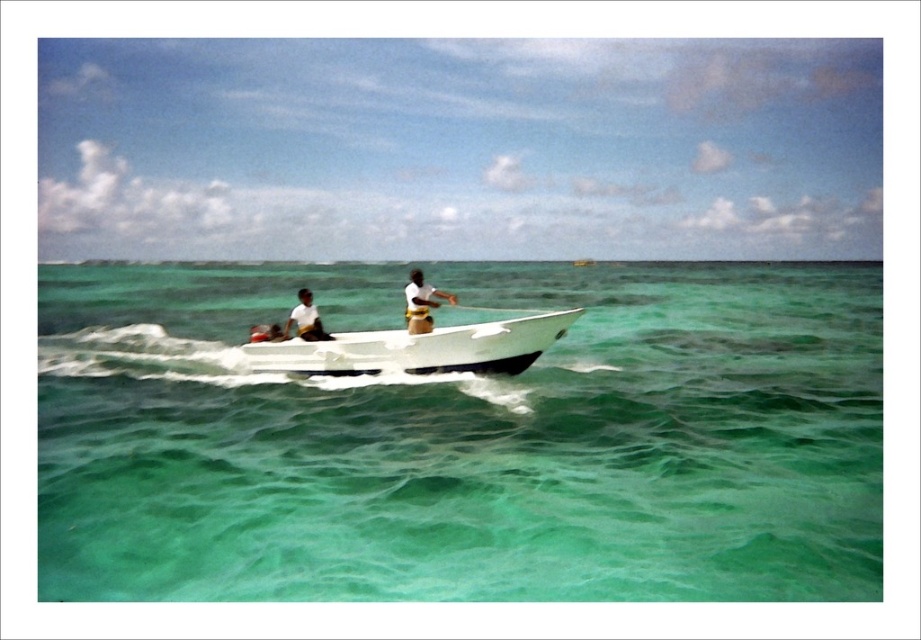
Question: Which object is the farthest from the white matte life vest at center?

Choices:
 (A) white matte shirt at center
 (B) white glossy boat at center
 (C) clear green water at center

Answer: (C)

Question: Can you confirm if white glossy boat at center is positioned to the left of white matte shirt at center?

Choices:
 (A) yes
 (B) no

Answer: (B)

Question: Is clear green water at center thinner than white matte life vest at center?

Choices:
 (A) no
 (B) yes

Answer: (A)

Question: Which point is closer to the camera?

Choices:
 (A) clear green water at center
 (B) white glossy boat at center

Answer: (A)

Question: Which point appears farthest from the camera in this image?

Choices:
 (A) (292, 356)
 (B) (510, 545)
 (C) (312, 305)

Answer: (C)

Question: Can you confirm if clear green water at center is positioned to the right of white matte life vest at center?

Choices:
 (A) yes
 (B) no

Answer: (B)